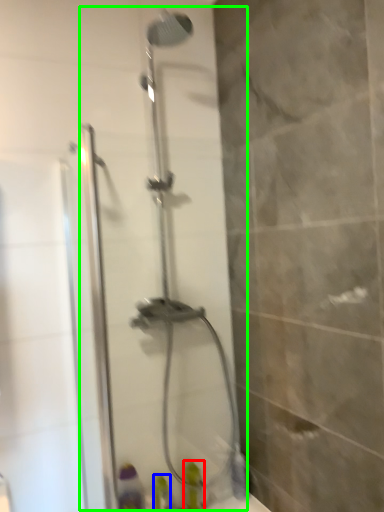
Question: Which is nearer to the toiletry (highlighted by a red box)? toiletry (highlighted by a blue box) or shower door (highlighted by a green box).

Choices:
 (A) toiletry
 (B) shower door

Answer: (A)